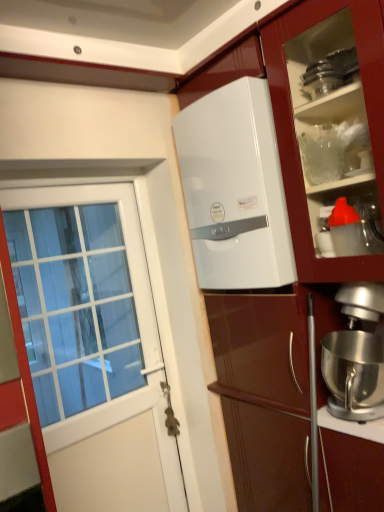
Question: From a real-world perspective, is metallic silver door handle at lower center beneath white glossy door at left?

Choices:
 (A) no
 (B) yes

Answer: (B)

Question: Considering the relative sizes of metallic silver door handle at lower center and white glossy door at left in the image provided, is metallic silver door handle at lower center thinner than white glossy door at left?

Choices:
 (A) no
 (B) yes

Answer: (B)

Question: Are metallic silver door handle at lower center and white glossy door at left far apart?

Choices:
 (A) yes
 (B) no

Answer: (B)

Question: Is metallic silver door handle at lower center further to camera compared to white glossy door at left?

Choices:
 (A) no
 (B) yes

Answer: (B)

Question: Is metallic silver door handle at lower center facing towards white glossy door at left?

Choices:
 (A) no
 (B) yes

Answer: (B)

Question: Considering the positions of point pos(226,257) and point pos(377,398), is point pos(226,257) closer or farther from the camera than point pos(377,398)?

Choices:
 (A) farther
 (B) closer

Answer: (A)

Question: Is white glossy water heater at upper center wider or thinner than silver metallic stand mixer at lower right?

Choices:
 (A) thin
 (B) wide

Answer: (A)

Question: From the image's perspective, is white glossy water heater at upper center positioned above or below silver metallic stand mixer at lower right?

Choices:
 (A) above
 (B) below

Answer: (A)

Question: From a real-world perspective, is white glossy water heater at upper center positioned above or below silver metallic stand mixer at lower right?

Choices:
 (A) below
 (B) above

Answer: (B)

Question: In terms of height, does metallic silver door handle at lower center look taller or shorter compared to white glossy water heater at upper center?

Choices:
 (A) short
 (B) tall

Answer: (A)

Question: Would you say metallic silver door handle at lower center is inside or outside white glossy water heater at upper center?

Choices:
 (A) outside
 (B) inside

Answer: (A)

Question: Is metallic silver door handle at lower center to the left or to the right of white glossy water heater at upper center in the image?

Choices:
 (A) right
 (B) left

Answer: (B)

Question: From the image's perspective, is metallic silver door handle at lower center located above or below white glossy water heater at upper center?

Choices:
 (A) below
 (B) above

Answer: (A)

Question: From their relative heights in the image, would you say silver metallic stand mixer at lower right is taller or shorter than white glossy water heater at upper center?

Choices:
 (A) short
 (B) tall

Answer: (A)

Question: Is silver metallic stand mixer at lower right in front of or behind white glossy water heater at upper center in the image?

Choices:
 (A) behind
 (B) front

Answer: (B)